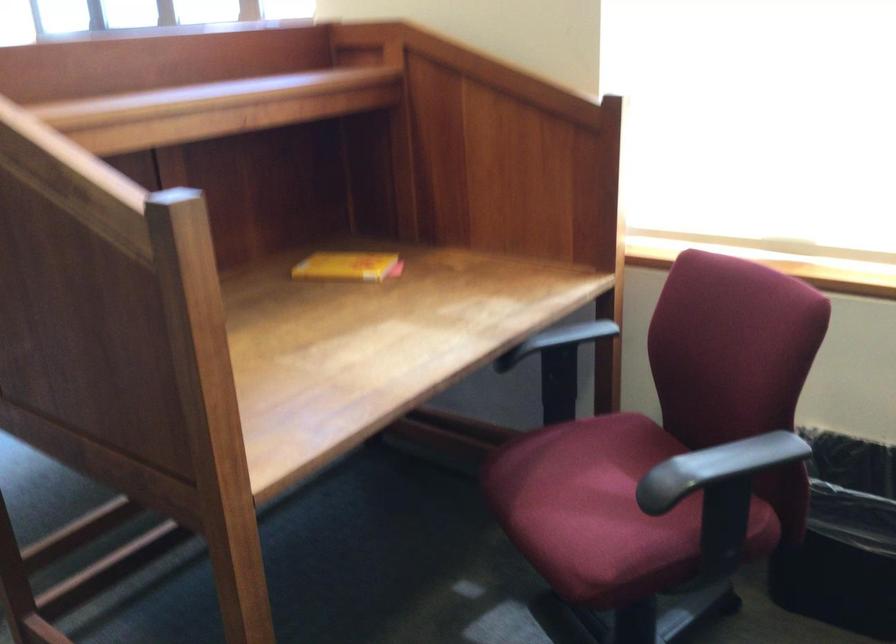
Identify the location of yellow box. The height and width of the screenshot is (644, 896). (348, 266).